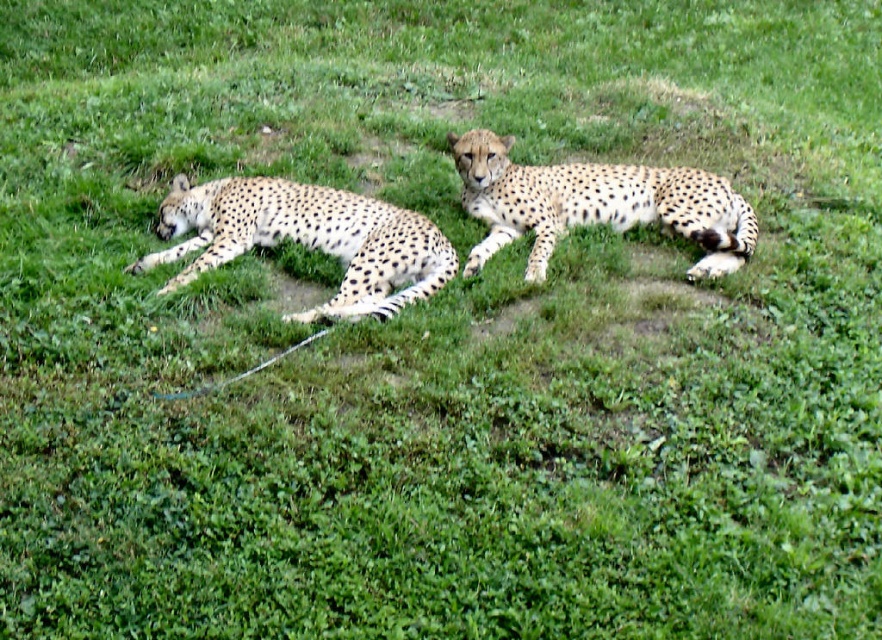
You are a zookeeper who needs to separate two cheetahs using a divider that is 3 feet wide. The divider must be placed between the spotted fur cheetah at left and the spotted fur cheetah at center. Will the divider fit between them?

The distance between the spotted fur cheetah at left and the spotted fur cheetah at center is 37.30 inches. Since 3 feet equals 36 inches, the divider will fit between them as there is enough space.